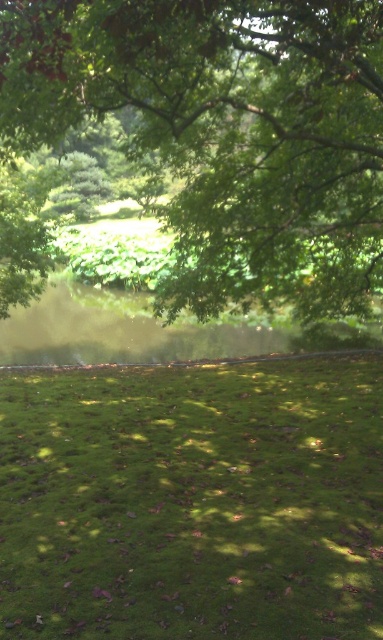
Question: Is green grassy field at center to the left of green leafy tree at upper center from the viewer's perspective?

Choices:
 (A) no
 (B) yes

Answer: (B)

Question: Is green grassy field at center above green leafy tree at upper center?

Choices:
 (A) yes
 (B) no

Answer: (B)

Question: Where is green grassy field at center located in relation to green leafy tree at upper center in the image?

Choices:
 (A) above
 (B) below

Answer: (B)

Question: Which object appears farthest from the camera in this image?

Choices:
 (A) green grassy field at center
 (B) green leafy tree at upper center

Answer: (A)

Question: Which point is closer to the camera?

Choices:
 (A) (214, 65)
 (B) (204, 586)

Answer: (B)